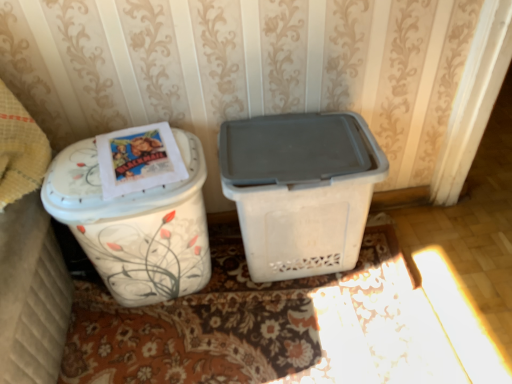
Question: In the image, is white plastic bin at center, acting as the second waste container starting from the left, positioned in front of or behind floral-patterned carpet at lower center?

Choices:
 (A) behind
 (B) front

Answer: (B)

Question: From a real-world perspective, relative to floral-patterned carpet at lower center, is white plastic bin at center, acting as the second waste container starting from the left, vertically above or below?

Choices:
 (A) below
 (B) above

Answer: (B)

Question: Which of these objects is positioned farthest from the white plastic bin at center, the first waste container when ordered from right to left?

Choices:
 (A) white floral-patterned container at left
 (B) white floral-patterned trash can at left, which ranks as the second waste container in right-to-left order
 (C) floral-patterned carpet at lower center

Answer: (A)

Question: Which of these objects is positioned farthest from the white floral-patterned container at left?

Choices:
 (A) white plastic bin at center, the first waste container when ordered from right to left
 (B) floral-patterned carpet at lower center
 (C) white floral-patterned trash can at left, the 1th waste container viewed from the left

Answer: (A)